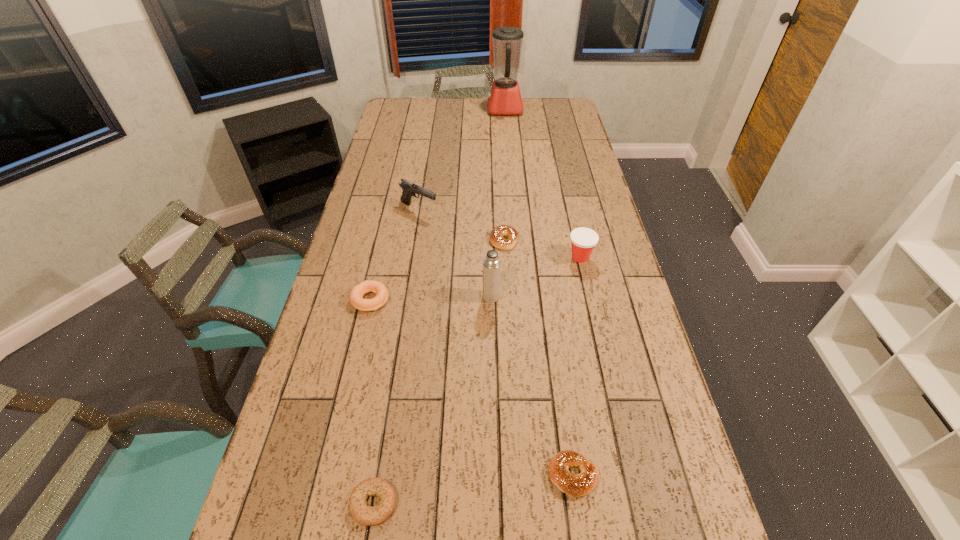
Image resolution: width=960 pixels, height=540 pixels. I want to click on free point between the thermos bottle and the rightmost bagel, so click(532, 386).

At what (x,y) coordinates should I click in order to perform the action: click on free area in between the tallest object and the seventh nearest object. Please return your answer as a coordinate pair (x, y). The height and width of the screenshot is (540, 960). Looking at the image, I should click on (462, 160).

Find the location of a particular element. The height and width of the screenshot is (540, 960). free space between the farthest bagel and the rightmost object is located at coordinates (542, 248).

You are a GUI agent. You are given a task and a screenshot of the screen. Output one action in this format:
    pyautogui.click(x=<x>, y=<y>)
    Task: Click on the seventh closest object to the rightmost bagel
    Image resolution: width=960 pixels, height=540 pixels.
    Given the screenshot: What is the action you would take?
    pyautogui.click(x=504, y=98)

Where is `the fifth closest object to the Dixie cup`? the fifth closest object to the Dixie cup is located at coordinates (582, 484).

Identify which bagel is located as the third nearest to the gun. Please provide its 2D coordinates. Your answer should be formatted as a tuple, i.e. [(x, y)], where the tuple contains the x and y coordinates of a point satisfying the conditions above.

[(582, 484)]

Point out which bagel is positioned as the second nearest to the third nearest bagel. Please provide its 2D coordinates. Your answer should be formatted as a tuple, i.e. [(x, y)], where the tuple contains the x and y coordinates of a point satisfying the conditions above.

[(365, 515)]

The width and height of the screenshot is (960, 540). Identify the location of free space that satisfies the following two spatial constraints: 1. at the muzzle of the rightmost object; 2. on the right side of the seventh nearest object. (411, 258).

This screenshot has height=540, width=960. Find the location of `vacant space that satisfies the following two spatial constraints: 1. on the front of the rightmost bagel near the controls; 2. on the right side of the farthest object`. vacant space that satisfies the following two spatial constraints: 1. on the front of the rightmost bagel near the controls; 2. on the right side of the farthest object is located at coordinates (536, 475).

You are a GUI agent. You are given a task and a screenshot of the screen. Output one action in this format:
    pyautogui.click(x=<x>, y=<y>)
    Task: Click on the vacant region that satisfies the following two spatial constraints: 1. at the muzzle of the thermos bottle; 2. on the left side of the third tallest object
    Image resolution: width=960 pixels, height=540 pixels.
    Given the screenshot: What is the action you would take?
    pyautogui.click(x=405, y=296)